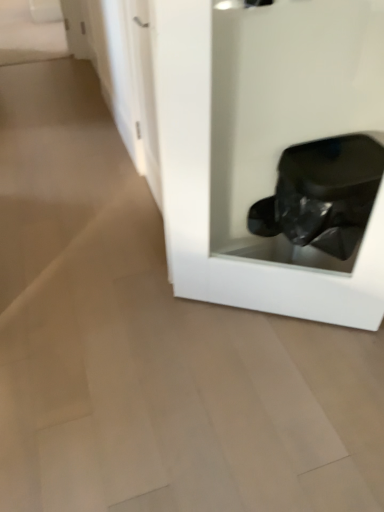
Where is `free space to the left of transparent glossy trash can at lower right`? free space to the left of transparent glossy trash can at lower right is located at coordinates (150, 353).